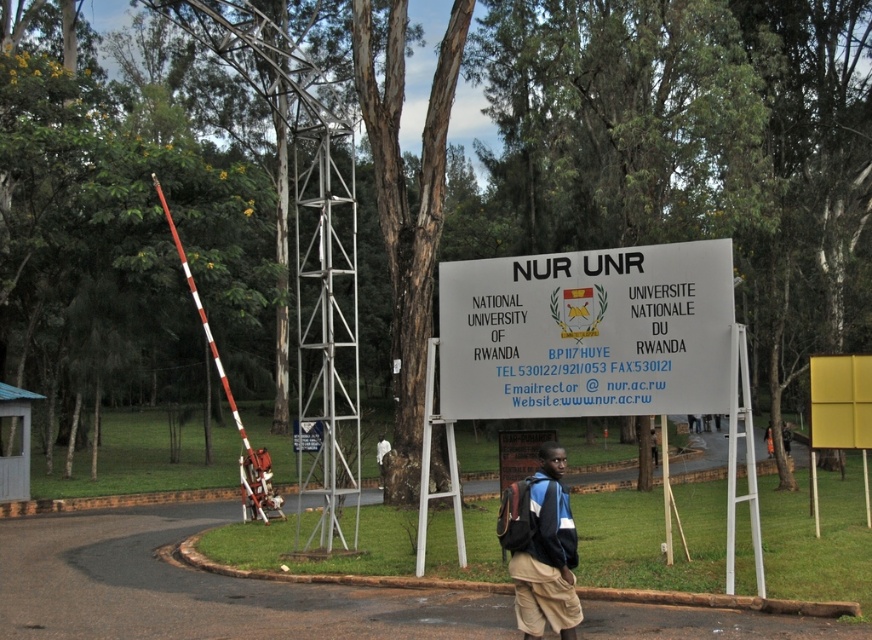
Question: Can you confirm if khaki shorts at center is positioned to the right of yellow matte sign at center?

Choices:
 (A) yes
 (B) no

Answer: (B)

Question: Considering the relative positions of white paper sign at center and yellow matte sign at center in the image provided, where is white paper sign at center located with respect to yellow matte sign at center?

Choices:
 (A) above
 (B) below

Answer: (A)

Question: Which point appears farthest from the camera in this image?

Choices:
 (A) (591, 316)
 (B) (823, 442)

Answer: (B)

Question: Does white paper sign at center have a greater width compared to khaki shorts at center?

Choices:
 (A) yes
 (B) no

Answer: (A)

Question: Considering the real-world distances, which object is closest to the khaki shorts at center?

Choices:
 (A) yellow matte sign at center
 (B) white paper sign at center

Answer: (B)

Question: Which point is closer to the camera?

Choices:
 (A) (453, 289)
 (B) (859, 358)
 (C) (561, 513)

Answer: (C)